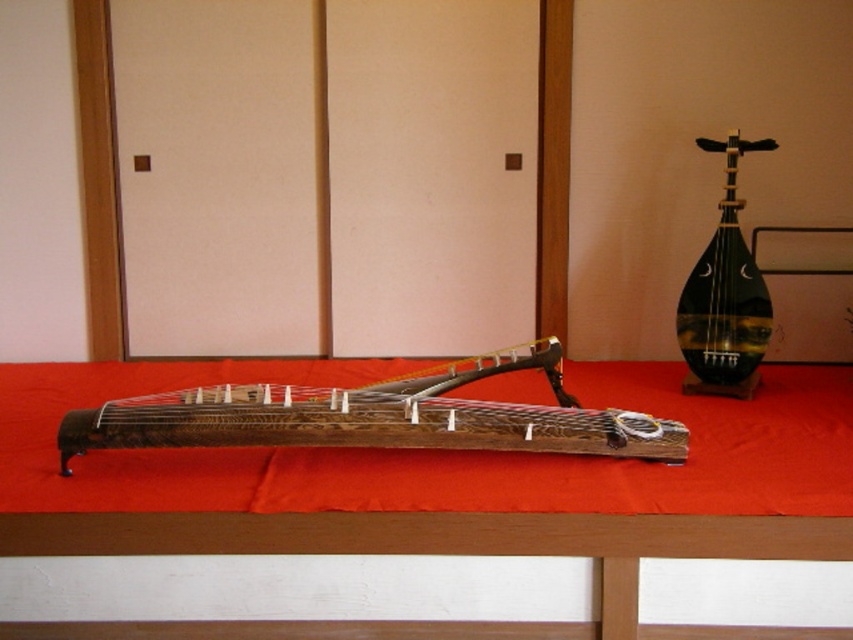
You are standing in front of the two instruments on the red cloth. You notice two points marked on the image. Which point is closer to you, point (x=207, y=403) or point (x=723, y=305)?

Point (x=207, y=403) is closer to the viewer than point (x=723, y=305).

Consider the image. You are a photographer standing 6 feet away from a wooden table with a red cloth. You want to take a closeup photo of the wooden stringed instrument at center. Is the instrument within your reach to adjust its position?

The wooden stringed instrument at center is 5.79 feet away from the camera, so it is within reach since you are standing 6 feet away from the table. You can adjust its position.

From the picture: You are organizing a music exhibition and need to place a stand between the wooden stringed instrument at center and the shiny dark green lute at right. If the stand must be placed closer to the taller instrument, which instrument should the stand be positioned near?

The stand should be placed near the shiny dark green lute at right because it is taller than the wooden stringed instrument at center.